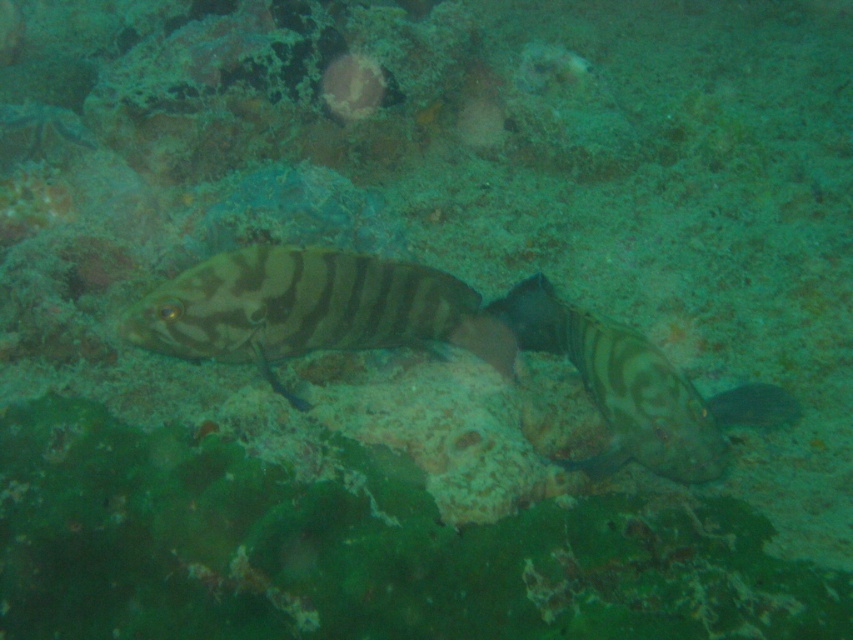
Can you confirm if striped matte fish at center is smaller than brown striped fish at center?

Correct, striped matte fish at center occupies less space than brown striped fish at center.

Locate an element on the screen. This screenshot has width=853, height=640. striped matte fish at center is located at coordinates (311, 308).

Between point (334, 269) and point (570, 358), which one is positioned behind?

The point (570, 358) is behind.

Identify the location of striped matte fish at center. (311, 308).